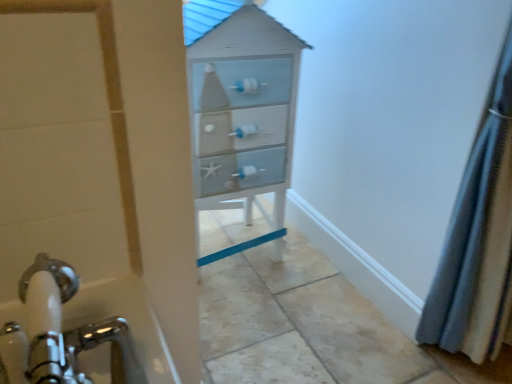
Where is `vacant area situated to the left side of gray fabric shower curtain at right`? The image size is (512, 384). vacant area situated to the left side of gray fabric shower curtain at right is located at coordinates (364, 340).